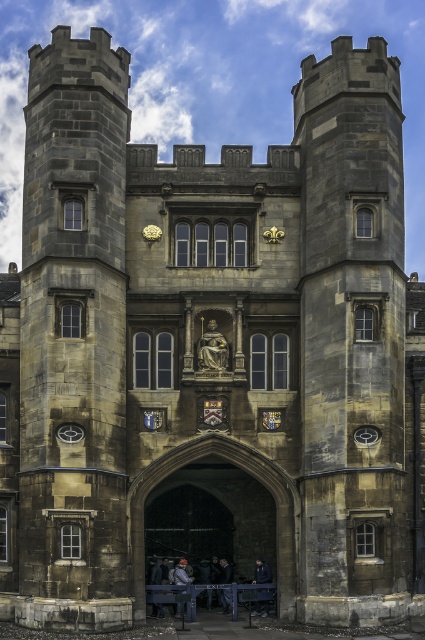
Between wooden park bench at lower center and gold metallic clock at lower right, which one has less height?

Standing shorter between the two is wooden park bench at lower center.

Is point (187, 593) farther from viewer compared to point (357, 444)?

Yes, point (187, 593) is behind point (357, 444).

Where is `wooden park bench at lower center`? The height and width of the screenshot is (640, 425). wooden park bench at lower center is located at coordinates (167, 596).

Between point (289, 566) and point (153, 592), which one is positioned behind?

The point (153, 592) is behind.

From the picture: Between stone archway at center and wooden park bench at lower center, which one has less height?

wooden park bench at lower center is shorter.

Is point (178, 460) in front of point (178, 598)?

Yes, it is in front of point (178, 598).

You are a GUI agent. You are given a task and a screenshot of the screen. Output one action in this format:
    pyautogui.click(x=<x>, y=<y>)
    Task: Click on the stone archway at center
    Image resolution: width=425 pixels, height=640 pixels.
    Given the screenshot: What is the action you would take?
    pyautogui.click(x=243, y=468)

Who is taller, stone archway at center or gold metallic clock at lower right?

stone archway at center is taller.

Find the location of `stone archway at center`. stone archway at center is located at coordinates (243, 468).

Between point (246, 461) and point (370, 436), which one is positioned behind?

Point (246, 461)

At what (x,y) coordinates should I click in order to perform the action: click on stone archway at center. Please return your answer as a coordinate pair (x, y). Image resolution: width=425 pixels, height=640 pixels. Looking at the image, I should click on (243, 468).